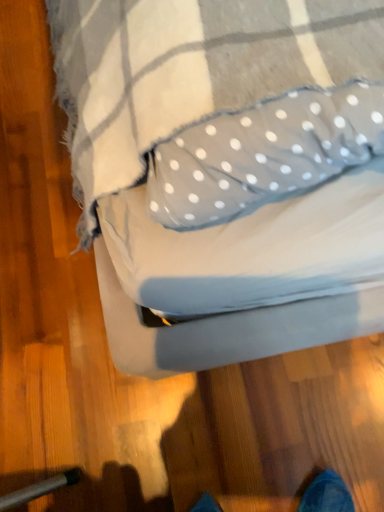
Find the location of a particular element. This screenshot has width=384, height=512. white polka dot fabric at center is located at coordinates (227, 172).

Describe the element at coordinates (227, 172) in the screenshot. I see `white polka dot fabric at center` at that location.

Locate an element on the screen. The image size is (384, 512). white polka dot fabric at center is located at coordinates (227, 172).